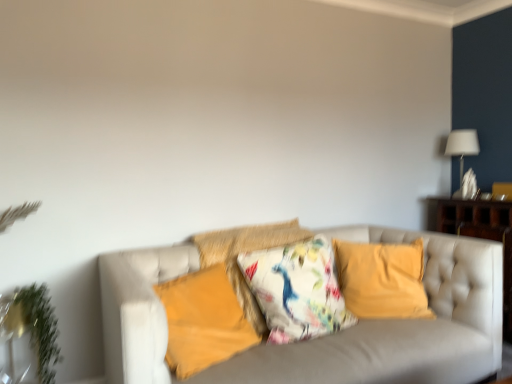
In order to face floral fabric cushion at center, which ranks as the third pillow in left-to-right order, should I rotate leftwards or rightwards?

It's best to rotate right around 5.728 degrees.

The height and width of the screenshot is (384, 512). Describe the element at coordinates (297, 290) in the screenshot. I see `floral fabric cushion at center, which ranks as the third pillow in left-to-right order` at that location.

This screenshot has height=384, width=512. What do you see at coordinates (382, 279) in the screenshot? I see `velvet yellow pillow at center, acting as the fourth pillow starting from the left` at bounding box center [382, 279].

What is the approximate height of matte yellow pillow at center, which ranks as the fourth pillow in right-to-left order?

matte yellow pillow at center, which ranks as the fourth pillow in right-to-left order, is 16.68 inches tall.

Consider the image. Measure the distance between floral fabric cushion at center, which is the third pillow in right-to-left order, and camera.

2.05 meters.

The width and height of the screenshot is (512, 384). Describe the element at coordinates (246, 252) in the screenshot. I see `floral fabric cushion at center, the second pillow viewed from the left` at that location.

You are a GUI agent. You are given a task and a screenshot of the screen. Output one action in this format:
    pyautogui.click(x=<x>, y=<y>)
    Task: Click on the floral fabric cushion at center, acting as the 2th pillow starting from the right
    The width and height of the screenshot is (512, 384).
    Given the screenshot: What is the action you would take?
    pyautogui.click(x=297, y=290)

How many degrees apart are the facing directions of green leafy plant at left and floral fabric cushion at center, acting as the 2th pillow starting from the right?

The angular difference between green leafy plant at left and floral fabric cushion at center, acting as the 2th pillow starting from the right, is 0.142 degrees.

The image size is (512, 384). Find the location of `the 2nd pillow above the green leafy plant at left (from the image's perspective)`. the 2nd pillow above the green leafy plant at left (from the image's perspective) is located at coordinates click(297, 290).

Is green leafy plant at left taller than floral fabric cushion at center, acting as the 2th pillow starting from the right?

No.

Which of these two, green leafy plant at left or floral fabric cushion at center, which ranks as the third pillow in left-to-right order, is wider?

With larger width is floral fabric cushion at center, which ranks as the third pillow in left-to-right order.

Which object is further away from the camera taking this photo, matte yellow pillow at center, which ranks as the fourth pillow in right-to-left order, or green leafy plant at left?

green leafy plant at left is behind.

Is matte yellow pillow at center, positioned as the 1th pillow in left-to-right order, completely or partially outside of green leafy plant at left?

Yes, matte yellow pillow at center, positioned as the 1th pillow in left-to-right order, is outside of green leafy plant at left.

Considering the sizes of objects matte yellow pillow at center, positioned as the 1th pillow in left-to-right order, and green leafy plant at left in the image provided, who is shorter, matte yellow pillow at center, positioned as the 1th pillow in left-to-right order, or green leafy plant at left?

Standing shorter between the two is matte yellow pillow at center, positioned as the 1th pillow in left-to-right order.

Who is bigger, matte yellow pillow at center, which ranks as the fourth pillow in right-to-left order, or green leafy plant at left?

Bigger between the two is matte yellow pillow at center, which ranks as the fourth pillow in right-to-left order.

Considering the relative positions of wooden dresser at right and white fabric lampshade at upper right in the image provided, is wooden dresser at right to the left of white fabric lampshade at upper right from the viewer's perspective?

In fact, wooden dresser at right is to the right of white fabric lampshade at upper right.

What's the angular difference between wooden dresser at right and white fabric lampshade at upper right's facing directions?

5.69e-05 degrees.

Is wooden dresser at right spatially inside white fabric lampshade at upper right, or outside of it?

wooden dresser at right is outside white fabric lampshade at upper right.

From a real-world perspective, is wooden dresser at right physically above white fabric lampshade at upper right?

No.

How different are the orientations of floral fabric cushion at center, the second pillow viewed from the left, and green leafy plant at left in degrees?

There is a 0.142-degree angle between the facing directions of floral fabric cushion at center, the second pillow viewed from the left, and green leafy plant at left.

Between floral fabric cushion at center, which is the third pillow in right-to-left order, and green leafy plant at left, which one has smaller size?

With smaller size is green leafy plant at left.

Is green leafy plant at left inside floral fabric cushion at center, the second pillow viewed from the left?

No.

Could you tell me if floral fabric cushion at center, which is the third pillow in right-to-left order, is facing green leafy plant at left?

No, floral fabric cushion at center, which is the third pillow in right-to-left order, is not oriented towards green leafy plant at left.

How distant is green leafy plant at left from floral fabric cushion at center, the second pillow viewed from the left?

The distance of green leafy plant at left from floral fabric cushion at center, the second pillow viewed from the left, is 36.78 inches.

Would you say green leafy plant at left is outside floral fabric cushion at center, the second pillow viewed from the left?

That's correct, green leafy plant at left is outside of floral fabric cushion at center, the second pillow viewed from the left.

Does green leafy plant at left lie in front of floral fabric cushion at center, the second pillow viewed from the left?

Yes, it is.

Considering the sizes of objects green leafy plant at left and wooden dresser at right in the image provided, who is wider, green leafy plant at left or wooden dresser at right?

wooden dresser at right is wider.

From a real-world perspective, is green leafy plant at left above or below wooden dresser at right?

In terms of real-world spatial position, green leafy plant at left is below wooden dresser at right.

From the image's perspective, does green leafy plant at left appear lower than wooden dresser at right?

Yes.

Could floral fabric cushion at center, acting as the 2th pillow starting from the right, be considered to be inside matte yellow pillow at center, which ranks as the fourth pillow in right-to-left order?

No.

From a real-world perspective, is matte yellow pillow at center, which ranks as the fourth pillow in right-to-left order, under floral fabric cushion at center, acting as the 2th pillow starting from the right?

Indeed, from a real-world perspective, matte yellow pillow at center, which ranks as the fourth pillow in right-to-left order, is positioned beneath floral fabric cushion at center, acting as the 2th pillow starting from the right.

Locate an element on the screen. This screenshot has height=384, width=512. pillow that is the 3rd one above the green leafy plant at left (from a real-world perspective) is located at coordinates (297, 290).

The height and width of the screenshot is (384, 512). I want to click on plant below the matte yellow pillow at center, positioned as the 1th pillow in left-to-right order (from the image's perspective), so click(40, 328).

Based on the photo, from the image, which object appears to be nearer to floral fabric cushion at center, which is the third pillow in right-to-left order, matte yellow pillow at center, positioned as the 1th pillow in left-to-right order, or green leafy plant at left?

matte yellow pillow at center, positioned as the 1th pillow in left-to-right order, lies closer to floral fabric cushion at center, which is the third pillow in right-to-left order, than the other object.

Looking at the image, which one is located further to floral fabric cushion at center, acting as the 2th pillow starting from the right, velvet yellow pillow at center, acting as the 1th pillow starting from the right, or wooden dresser at right?

wooden dresser at right is positioned further to the anchor floral fabric cushion at center, acting as the 2th pillow starting from the right.

From the image, which object appears to be nearer to velvet yellow pillow at center, acting as the 1th pillow starting from the right, floral fabric cushion at center, which ranks as the third pillow in left-to-right order, or white fabric lampshade at upper right?

floral fabric cushion at center, which ranks as the third pillow in left-to-right order, lies closer to velvet yellow pillow at center, acting as the 1th pillow starting from the right, than the other object.

When comparing their distances from green leafy plant at left, does matte yellow pillow at center, positioned as the 1th pillow in left-to-right order, or floral fabric cushion at center, which ranks as the third pillow in left-to-right order, seem closer?

Based on the image, matte yellow pillow at center, positioned as the 1th pillow in left-to-right order, appears to be nearer to green leafy plant at left.

Estimate the real-world distances between objects in this image. Which object is closer to floral fabric cushion at center, the second pillow viewed from the left, matte yellow pillow at center, which ranks as the fourth pillow in right-to-left order, or wooden dresser at right?

matte yellow pillow at center, which ranks as the fourth pillow in right-to-left order, is positioned closer to the anchor floral fabric cushion at center, the second pillow viewed from the left.

Which object lies nearer to the anchor point wooden dresser at right, white fabric lampshade at upper right or velvet yellow pillow at center, acting as the 1th pillow starting from the right?

Among the two, white fabric lampshade at upper right is located nearer to wooden dresser at right.

Which object lies nearer to the anchor point white fabric lampshade at upper right, floral fabric cushion at center, which is the third pillow in right-to-left order, or velvet yellow pillow at center, acting as the 1th pillow starting from the right?

velvet yellow pillow at center, acting as the 1th pillow starting from the right.

Looking at the image, which one is located closer to matte yellow pillow at center, positioned as the 1th pillow in left-to-right order, green leafy plant at left or floral fabric cushion at center, acting as the 2th pillow starting from the right?

floral fabric cushion at center, acting as the 2th pillow starting from the right, is closer to matte yellow pillow at center, positioned as the 1th pillow in left-to-right order.

What are the coordinates of `pillow between green leafy plant at left and floral fabric cushion at center, the second pillow viewed from the left, in the horizontal direction` in the screenshot? It's located at (203, 321).

At what (x,y) coordinates should I click in order to perform the action: click on pillow located between floral fabric cushion at center, acting as the 2th pillow starting from the right, and wooden dresser at right in the left-right direction. Please return your answer as a coordinate pair (x, y). This screenshot has height=384, width=512. Looking at the image, I should click on (382, 279).

Where is `table lamp between green leafy plant at left and wooden dresser at right`? This screenshot has width=512, height=384. table lamp between green leafy plant at left and wooden dresser at right is located at coordinates (462, 146).

Identify the location of pillow located between floral fabric cushion at center, acting as the 2th pillow starting from the right, and white fabric lampshade at upper right in the left-right direction. Image resolution: width=512 pixels, height=384 pixels. (382, 279).